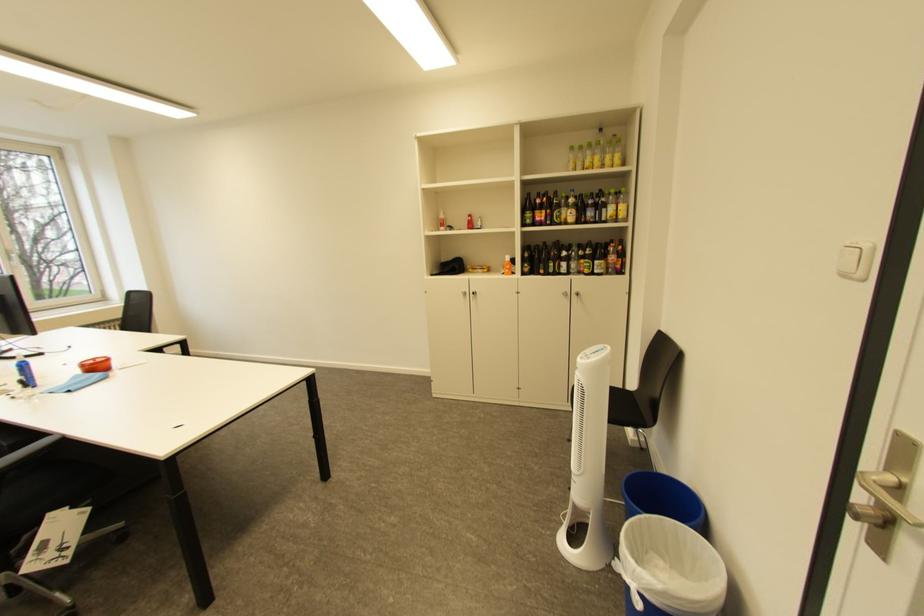
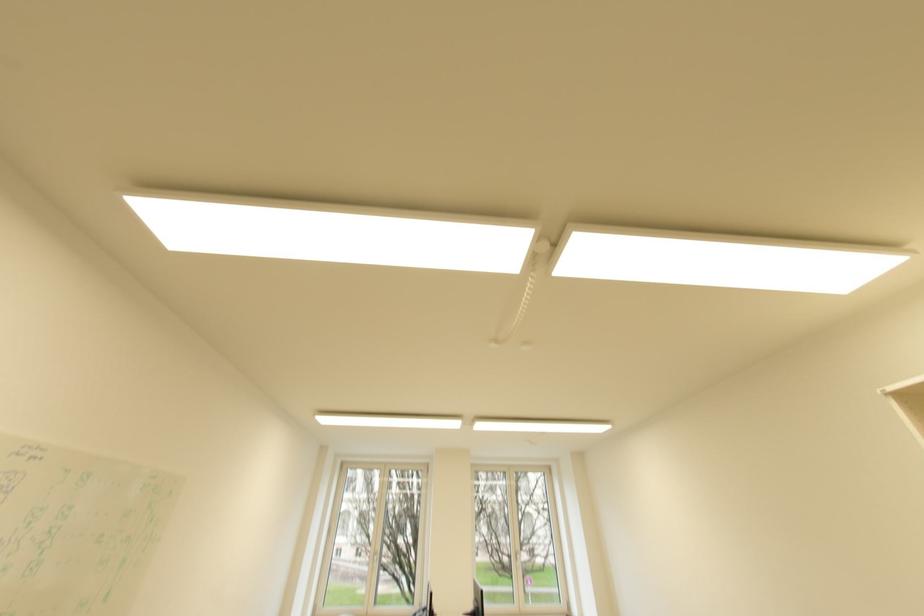
The images are taken continuously from a first-person perspective. In which direction is your viewpoint rotating?

The rotation direction of the camera is left-up.